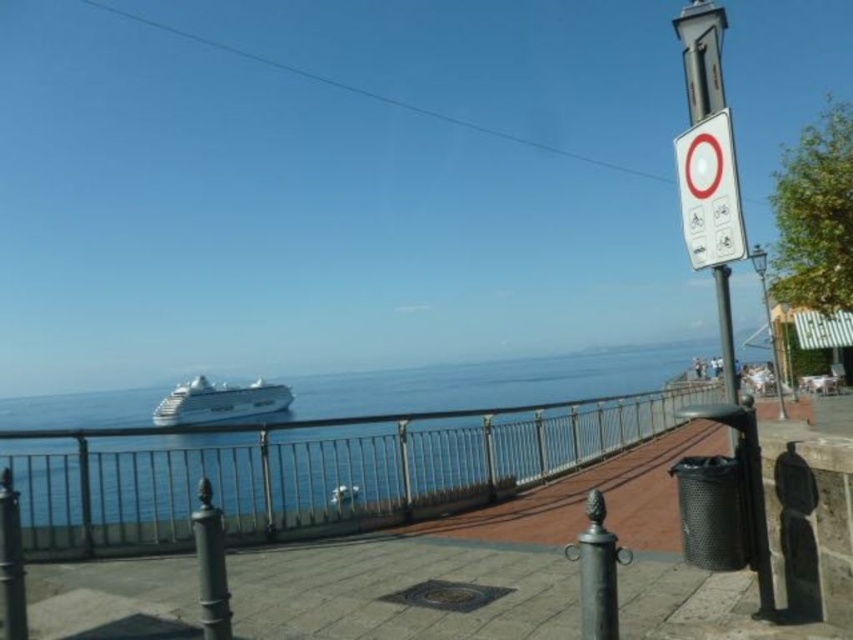
You are standing on the promenade and want to take a photo of the white glossy cruise ship at center without the white plastic sign at upper right appearing in the frame. Which direction should you move to ensure the sign is out of view?

Move to the left to ensure the white plastic sign at upper right is out of view since it is to the right of the white glossy cruise ship at center.

You are standing at the point with coordinates 0.5, 0.5 in the image. Which direction should you move to get closer to the blue water at center?

The blue water at center is located at point (310,468). Since you are at (426,320), you should move towards the right and slightly downward to reach it.